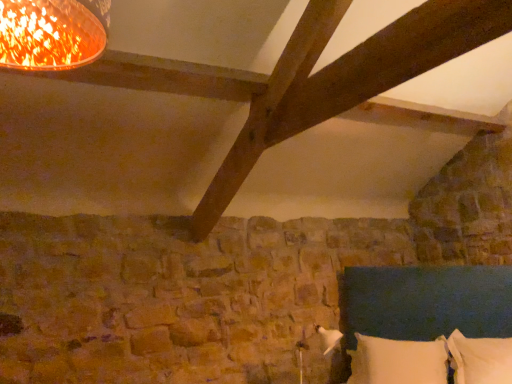
Question: Is white soft pillow at lower right, which ranks as the 2th pillow in right-to-left order, bigger than white soft pillow at lower right, the 1th pillow viewed from the right?

Choices:
 (A) no
 (B) yes

Answer: (B)

Question: From a real-world perspective, is white soft pillow at lower right, which ranks as the 2th pillow in right-to-left order, on top of white soft pillow at lower right, the 1th pillow viewed from the right?

Choices:
 (A) yes
 (B) no

Answer: (B)

Question: Is white soft pillow at lower right, which ranks as the 2th pillow in right-to-left order, positioned before white soft pillow at lower right, which appears as the second pillow when viewed from the left?

Choices:
 (A) no
 (B) yes

Answer: (A)

Question: Is white soft pillow at lower right, which ranks as the 1th pillow in left-to-right order, looking in the opposite direction of white soft pillow at lower right, which appears as the second pillow when viewed from the left?

Choices:
 (A) yes
 (B) no

Answer: (B)

Question: Does white soft pillow at lower right, which ranks as the 2th pillow in right-to-left order, appear on the left side of white soft pillow at lower right, which appears as the second pillow when viewed from the left?

Choices:
 (A) no
 (B) yes

Answer: (B)

Question: Does white soft pillow at lower right, which ranks as the 1th pillow in left-to-right order, have a lesser width compared to white soft pillow at lower right, which appears as the second pillow when viewed from the left?

Choices:
 (A) yes
 (B) no

Answer: (B)

Question: From a real-world perspective, is dark blue fabric bed at lower right physically below white soft pillow at lower right, the 1th pillow viewed from the right?

Choices:
 (A) yes
 (B) no

Answer: (B)

Question: Could white soft pillow at lower right, which appears as the second pillow when viewed from the left, be considered to be inside dark blue fabric bed at lower right?

Choices:
 (A) no
 (B) yes

Answer: (B)

Question: Is dark blue fabric bed at lower right wider than white soft pillow at lower right, the 1th pillow viewed from the right?

Choices:
 (A) yes
 (B) no

Answer: (A)

Question: From the image's perspective, would you say dark blue fabric bed at lower right is positioned over white soft pillow at lower right, which appears as the second pillow when viewed from the left?

Choices:
 (A) no
 (B) yes

Answer: (B)

Question: Is dark blue fabric bed at lower right outside of white soft pillow at lower right, the 1th pillow viewed from the right?

Choices:
 (A) no
 (B) yes

Answer: (B)

Question: Is dark blue fabric bed at lower right far away from white soft pillow at lower right, which appears as the second pillow when viewed from the left?

Choices:
 (A) no
 (B) yes

Answer: (A)

Question: Is dark blue fabric bed at lower right positioned with its back to white soft pillow at lower right, which ranks as the 1th pillow in left-to-right order?

Choices:
 (A) no
 (B) yes

Answer: (B)